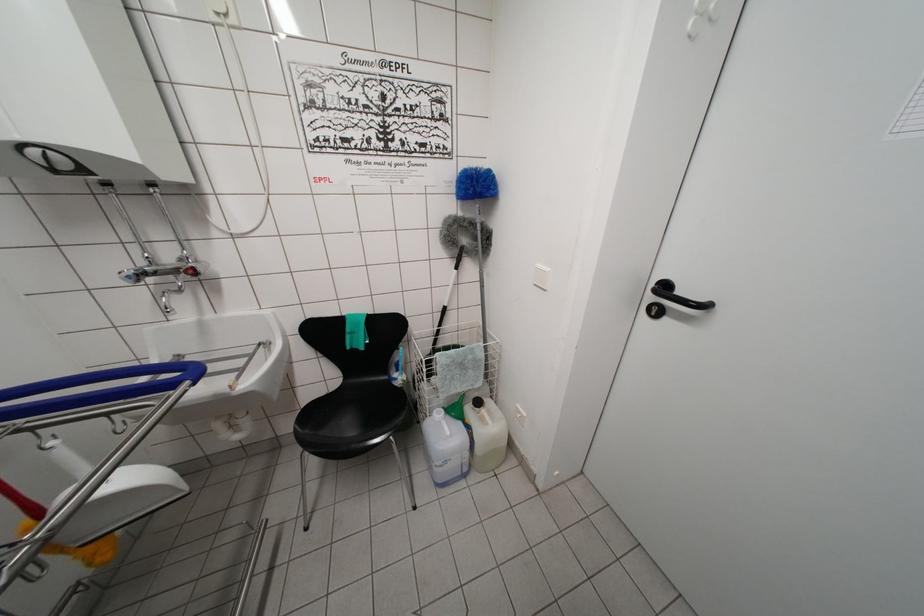
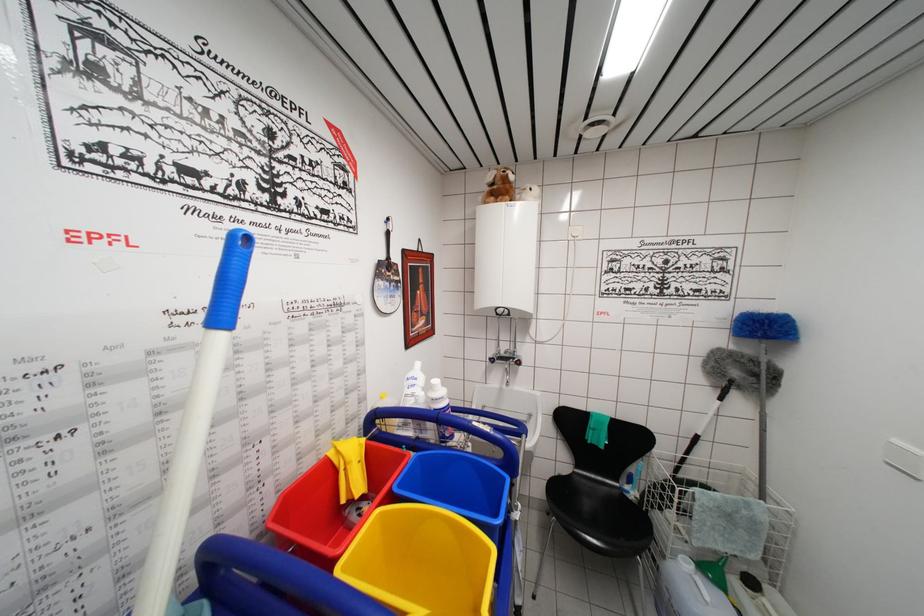
Question: The first image is from the beginning of the video and the second image is from the end. How did the camera likely rotate when shooting the video?

Choices:
 (A) Left
 (B) Right
 (C) Up
 (D) Down

Answer: (A)